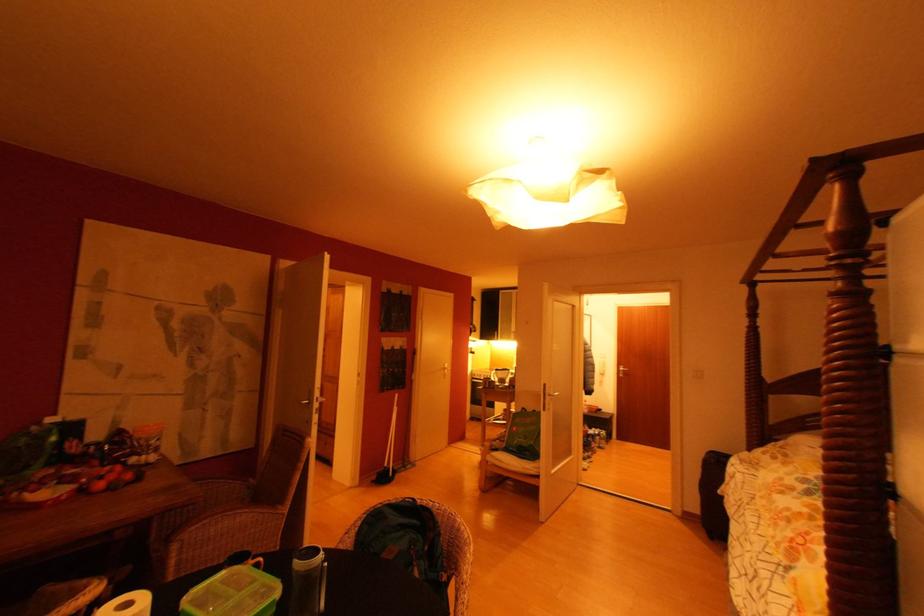
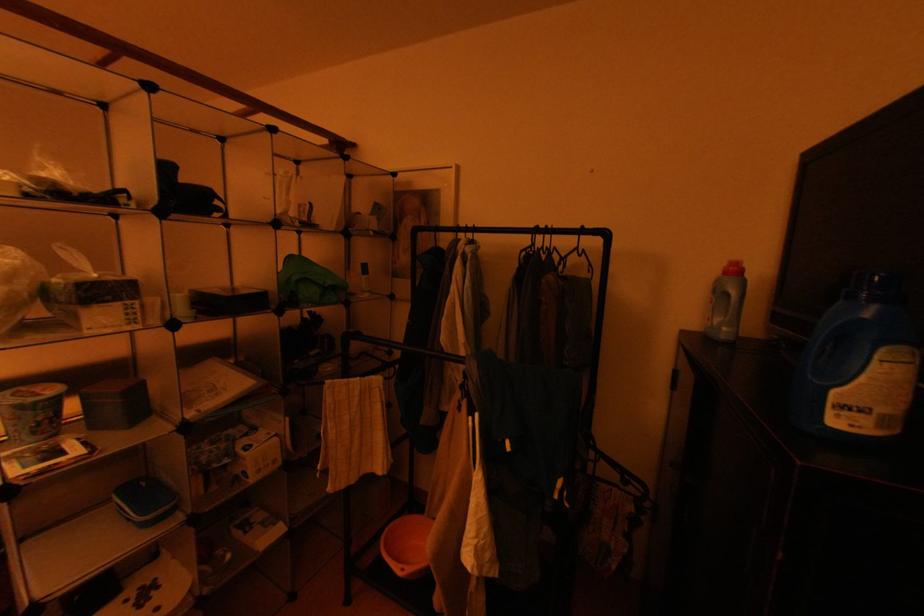
Question: The first image is from the beginning of the video and the second image is from the end. How did the camera likely rotate when shooting the video?

Choices:
 (A) Left
 (B) Right
 (C) Up
 (D) Down

Answer: (B)